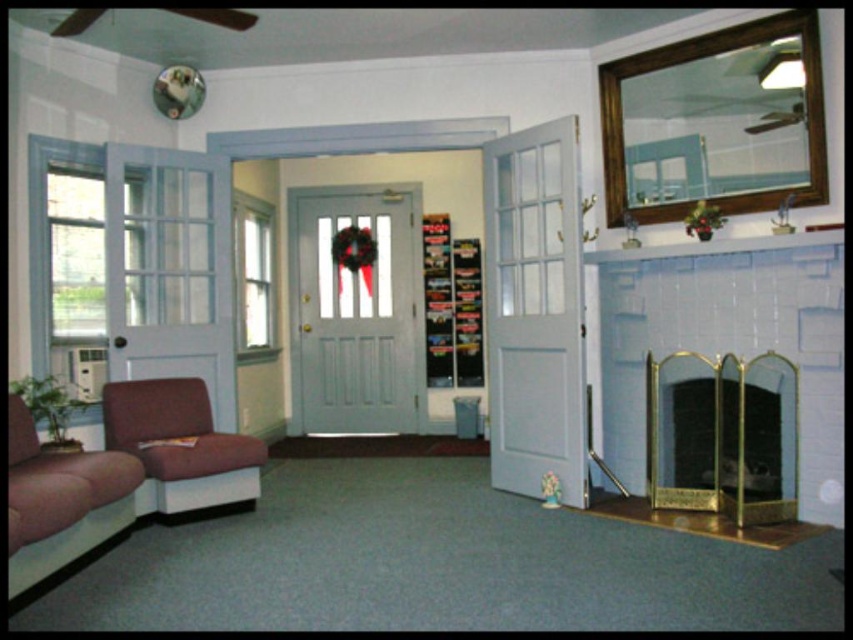
You are sitting on the velvet maroon armchair at lower left and want to move to the velvet maroon couch at lower left. According to the scene description, which direction should you move to reach the couch?

The velvet maroon couch at lower left is below the velvet maroon armchair at lower left, so you should move downward to reach the couch.

You are standing in the living room and want to determine the relative positions of two points marked in the image. Which point is closer to you, point at coordinates (416, 211) or point at coordinates (547, 493)?

Point at coordinates (416, 211) is closer to you because it is further to the camera than point at coordinates (547, 493).

You are planning to place a floor lamp between the velvet maroon couch at lower left and the velvet maroon armchair at lower left. Which object should the lamp be placed closer to if you want it to be closer to the taller piece of furniture?

The velvet maroon armchair at lower left is taller than the velvet maroon couch at lower left. Therefore, the floor lamp should be placed closer to the velvet maroon armchair at lower left to be near the taller furniture.